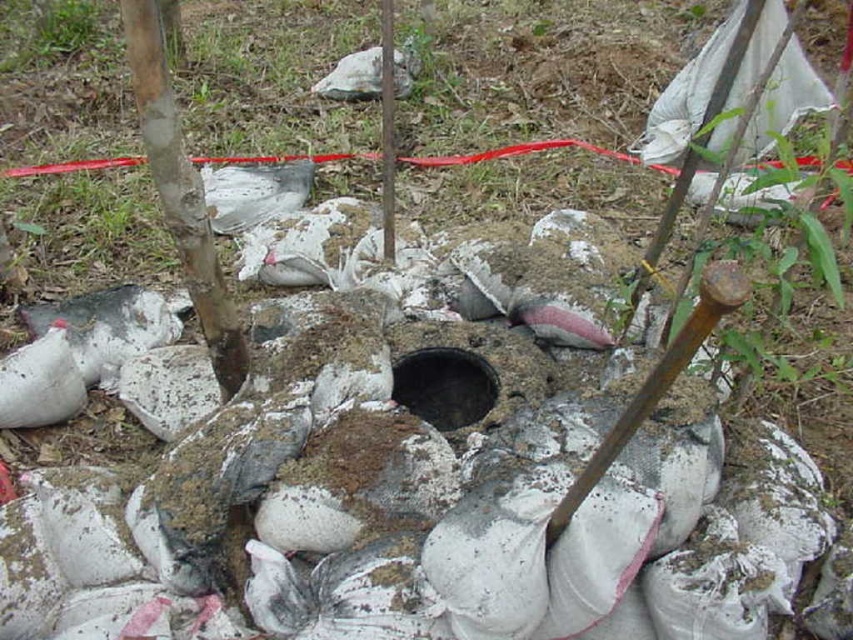
You are a construction worker standing at the entrance of the sandbag structure. You need to place a new pole exactly at the center of the circular opening. Is the smooth bark pole at center currently positioned correctly for this purpose?

The smooth bark pole at center is located at point (181, 193), so it is positioned correctly at the center of the circular opening.

You are a construction worker who needs to choose between the smooth bark pole at center and the brushed metal pole at center for a project requiring a thicker material. Which pole should you select based on their widths?

The smooth bark pole at center has a greater width than the brushed metal pole at center, so you should choose the smooth bark pole at center for the project requiring thicker material.

Imagine you are standing at the sandbag structure and looking towards the two points marked in the image. Which point, point (213, 326) or point (692, 339), is closer to your position?

Point (213, 326) is closer to your position because it is further to the camera than point (692, 339).